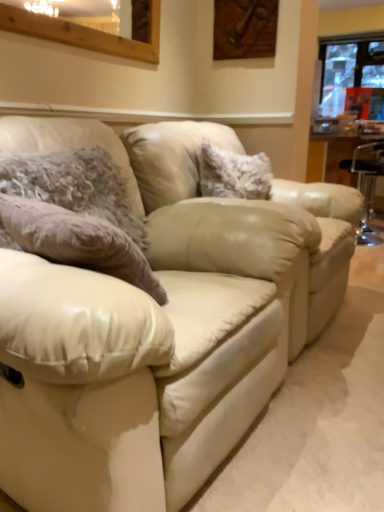
Question: Can you confirm if matte cream leather couch at center is positioned to the left of fuzzy fabric pillow at center, which is counted as the second pillow, starting from the front?

Choices:
 (A) yes
 (B) no

Answer: (A)

Question: Is matte cream leather couch at center outside fuzzy fabric pillow at center, which ranks as the second pillow in left-to-right order?

Choices:
 (A) no
 (B) yes

Answer: (B)

Question: Is fuzzy fabric pillow at center, which is counted as the second pillow, starting from the front, at the back of matte cream leather couch at center?

Choices:
 (A) yes
 (B) no

Answer: (B)

Question: Could you tell me if matte cream leather couch at center is turned towards fuzzy fabric pillow at center, which appears as the 1th pillow when viewed from the back?

Choices:
 (A) yes
 (B) no

Answer: (B)

Question: Is matte cream leather couch at center next to fuzzy fabric pillow at center, which appears as the 1th pillow when viewed from the back?

Choices:
 (A) yes
 (B) no

Answer: (B)

Question: Is fuzzy fabric pillow at left, which appears as the first pillow when viewed from the left, in front of or behind beige leather swivel chair at center in the image?

Choices:
 (A) front
 (B) behind

Answer: (A)

Question: From a real-world perspective, is fuzzy fabric pillow at left, arranged as the 1th pillow when viewed from the front, physically located above or below beige leather swivel chair at center?

Choices:
 (A) above
 (B) below

Answer: (A)

Question: Considering the positions of fuzzy fabric pillow at left, arranged as the 1th pillow when viewed from the front, and beige leather swivel chair at center in the image, is fuzzy fabric pillow at left, arranged as the 1th pillow when viewed from the front, taller or shorter than beige leather swivel chair at center?

Choices:
 (A) short
 (B) tall

Answer: (A)

Question: From the image's perspective, is fuzzy fabric pillow at left, arranged as the 1th pillow when viewed from the front, above or below beige leather swivel chair at center?

Choices:
 (A) below
 (B) above

Answer: (A)

Question: Based on their sizes in the image, would you say fuzzy fabric pillow at center, which appears as the 1th pillow when viewed from the back, is bigger or smaller than fuzzy fabric pillow at left, placed as the second pillow when sorted from right to left?

Choices:
 (A) small
 (B) big

Answer: (A)

Question: From their relative heights in the image, would you say fuzzy fabric pillow at center, acting as the first pillow starting from the right, is taller or shorter than fuzzy fabric pillow at left, placed as the second pillow when sorted from right to left?

Choices:
 (A) tall
 (B) short

Answer: (B)

Question: In terms of width, does fuzzy fabric pillow at center, which ranks as the second pillow in left-to-right order, look wider or thinner when compared to fuzzy fabric pillow at left, arranged as the 1th pillow when viewed from the front?

Choices:
 (A) wide
 (B) thin

Answer: (A)

Question: Considering their positions, is fuzzy fabric pillow at center, which appears as the 1th pillow when viewed from the back, located in front of or behind fuzzy fabric pillow at left, placed as the second pillow when sorted from right to left?

Choices:
 (A) behind
 (B) front

Answer: (A)

Question: Is wooden frame at upper left, which is counted as the 2th window, starting from the top, inside or outside of matte cream leather couch at center?

Choices:
 (A) outside
 (B) inside

Answer: (A)

Question: Is wooden frame at upper left, the second window in the back-to-front sequence, in front of or behind matte cream leather couch at center in the image?

Choices:
 (A) behind
 (B) front

Answer: (A)